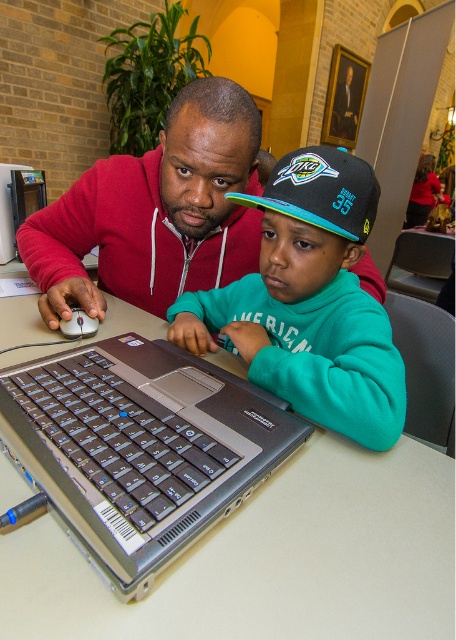
Can you confirm if blue and teal fabric baseball cap at center is shorter than matte black mouse at left?

Incorrect, blue and teal fabric baseball cap at center's height does not fall short of matte black mouse at left's.

Does blue and teal fabric baseball cap at center come behind matte black mouse at left?

No, blue and teal fabric baseball cap at center is in front of matte black mouse at left.

Which is in front, point (229, 196) or point (79, 330)?

Point (229, 196) is more forward.

Find the location of a particular element. blue and teal fabric baseball cap at center is located at coordinates (321, 192).

Who is more distant from viewer, (206, 371) or (315, 198)?

The point (206, 371) is more distant.

Between silver metallic laptop at center and blue and teal fabric baseball cap at center, which one is positioned lower?

silver metallic laptop at center is lower down.

Is point (136, 381) positioned behind point (314, 221)?

No, it is in front of (314, 221).

This screenshot has height=640, width=456. I want to click on silver metallic laptop at center, so click(x=140, y=448).

Which is more to the left, matte red hoodie at center or matte black mouse at left?

matte black mouse at left

Who is more forward, (181, 284) or (77, 314)?

Positioned in front is point (77, 314).

Between point (176, 234) and point (62, 321), which one is positioned in front?

Point (62, 321) is more forward.

I want to click on matte red hoodie at center, so click(155, 212).